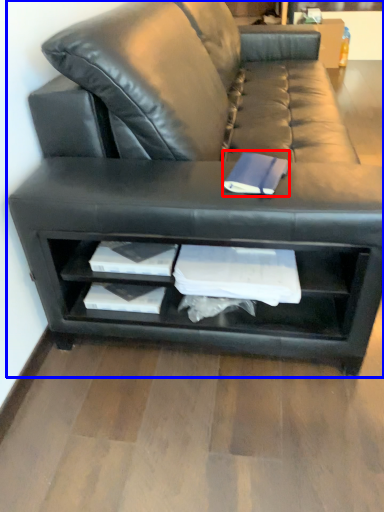
Question: Among these objects, which one is nearest to the camera, paperback book (highlighted by a red box) or studio couch (highlighted by a blue box)?

Choices:
 (A) paperback book
 (B) studio couch

Answer: (B)